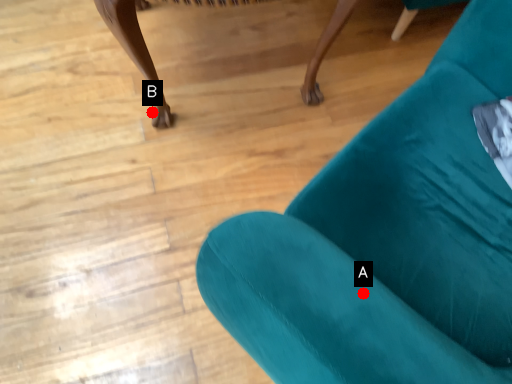
Question: Two points are circled on the image, labeled by A and B beside each circle. Which point is closer to the camera taking this photo?

Choices:
 (A) A is closer
 (B) B is closer

Answer: (A)